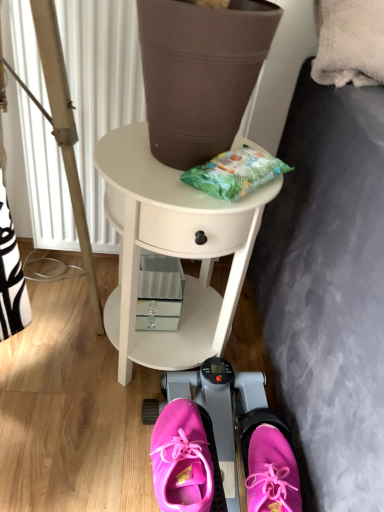
This screenshot has width=384, height=512. Find the location of `vacant space underneath wooden tripod at left (from a real-world perspective)`. vacant space underneath wooden tripod at left (from a real-world perspective) is located at coordinates (52, 291).